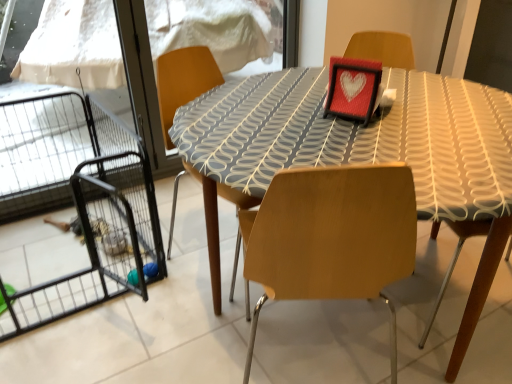
This screenshot has height=384, width=512. What are the coordinates of `black wire cage at left` in the screenshot? It's located at (77, 197).

What is the approximate width of black wire cage at left?

The width of black wire cage at left is 3.58 feet.

What is the approximate height of black wire cage at left?

The height of black wire cage at left is 23.99 inches.

The height and width of the screenshot is (384, 512). What do you see at coordinates (77, 197) in the screenshot? I see `black wire cage at left` at bounding box center [77, 197].

You are a GUI agent. You are given a task and a screenshot of the screen. Output one action in this format:
    pyautogui.click(x=<x>, y=<y>)
    Task: Click on the matte gray fabric table at center
    This screenshot has width=512, height=384.
    Given the screenshot: What is the action you would take?
    pyautogui.click(x=367, y=148)

Image resolution: width=512 pixels, height=384 pixels. What do you see at coordinates (367, 148) in the screenshot?
I see `matte gray fabric table at center` at bounding box center [367, 148].

Where is `black wire cage at left`? Image resolution: width=512 pixels, height=384 pixels. black wire cage at left is located at coordinates (77, 197).

Which object is positioned more to the right, black wire cage at left or matte gray fabric table at center?

Positioned to the right is matte gray fabric table at center.

Considering their positions, is black wire cage at left located in front of or behind matte gray fabric table at center?

Clearly, black wire cage at left is behind matte gray fabric table at center.

Looking at this image, which is less distant, [103,264] or [256,132]?

Positioned in front is point [256,132].

From the image's perspective, relative to matte gray fabric table at center, is black wire cage at left above or below?

black wire cage at left is below matte gray fabric table at center.

From a real-world perspective, is black wire cage at left positioned above or below matte gray fabric table at center?

Answer: black wire cage at left is situated lower than matte gray fabric table at center in the real world.

Considering the sizes of black wire cage at left and matte gray fabric table at center in the image, is black wire cage at left wider or thinner than matte gray fabric table at center?

Considering their sizes, black wire cage at left looks slimmer than matte gray fabric table at center.

Is black wire cage at left taller than matte gray fabric table at center?

No, black wire cage at left is not taller than matte gray fabric table at center.

Is black wire cage at left bigger or smaller than matte gray fabric table at center?

Considering their sizes, black wire cage at left takes up less space than matte gray fabric table at center.

Would you say black wire cage at left is inside or outside matte gray fabric table at center?

black wire cage at left is spatially situated outside matte gray fabric table at center.

Is black wire cage at left placed right next to matte gray fabric table at center?

No, black wire cage at left is not next to matte gray fabric table at center.

Is matte gray fabric table at center at the back of black wire cage at left?

black wire cage at left is not turned away from matte gray fabric table at center.

What's the angular difference between black wire cage at left and matte gray fabric table at center's facing directions?

5.06 degrees.

You are a GUI agent. You are given a task and a screenshot of the screen. Output one action in this format:
    pyautogui.click(x=<x>, y=<y>)
    Task: Click on the table positioned vertically above the black wire cage at left (from a real-world perspective)
    The image size is (512, 384).
    Given the screenshot: What is the action you would take?
    pyautogui.click(x=367, y=148)

From the picture: Can you confirm if matte gray fabric table at center is positioned to the left of black wire cage at left?

Incorrect, matte gray fabric table at center is not on the left side of black wire cage at left.

Which object is closer to the camera, matte gray fabric table at center or black wire cage at left?

matte gray fabric table at center is more forward.

Which is behind, point (267, 148) or point (55, 115)?

The point (55, 115) is farther from the camera.

From the image's perspective, would you say matte gray fabric table at center is positioned over black wire cage at left?

Yes, from the image's perspective, matte gray fabric table at center is above black wire cage at left.

From a real-world perspective, between matte gray fabric table at center and black wire cage at left, who is vertically higher?

matte gray fabric table at center, from a real-world perspective.

Which of these two, matte gray fabric table at center or black wire cage at left, is thinner?

Thinner between the two is black wire cage at left.

Does matte gray fabric table at center have a lesser height compared to black wire cage at left?

Incorrect, the height of matte gray fabric table at center does not fall short of that of black wire cage at left.

Looking at this image, looking at the image, does matte gray fabric table at center seem bigger or smaller compared to black wire cage at left?

matte gray fabric table at center is bigger than black wire cage at left.

Could black wire cage at left be considered to be inside matte gray fabric table at center?

No, black wire cage at left is not inside matte gray fabric table at center.

Is matte gray fabric table at center positioned far away from black wire cage at left?

Yes, matte gray fabric table at center is far from black wire cage at left.

In the scene shown: Is matte gray fabric table at center turned away from black wire cage at left?

No, matte gray fabric table at center is not facing away from black wire cage at left.

The height and width of the screenshot is (384, 512). Find the location of `cage lying on the left of matte gray fabric table at center`. cage lying on the left of matte gray fabric table at center is located at coordinates (77, 197).

Find the location of a particular element. table that appears above the black wire cage at left (from a real-world perspective) is located at coordinates (367, 148).

This screenshot has height=384, width=512. What are the coordinates of `cage below the matte gray fabric table at center (from a real-world perspective)` in the screenshot? It's located at (77, 197).